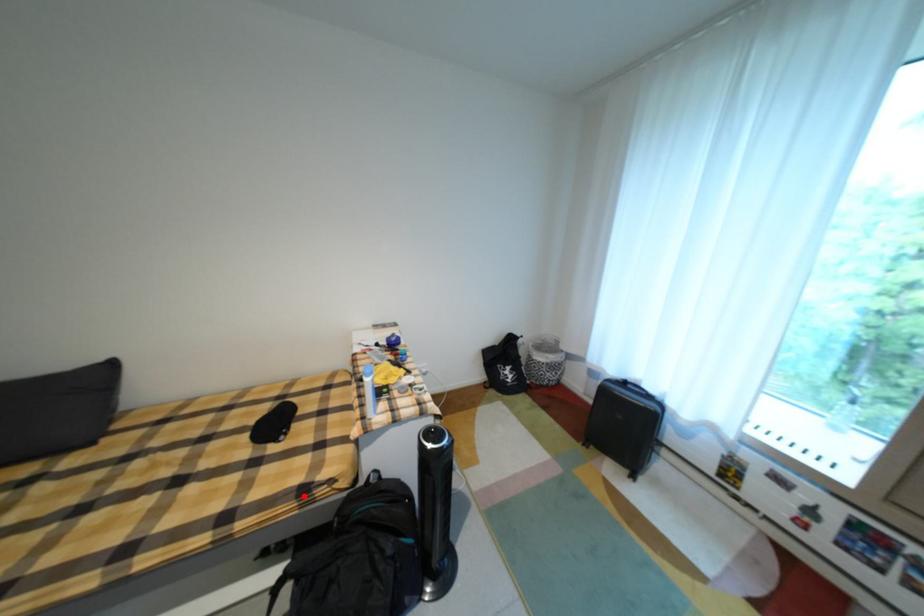
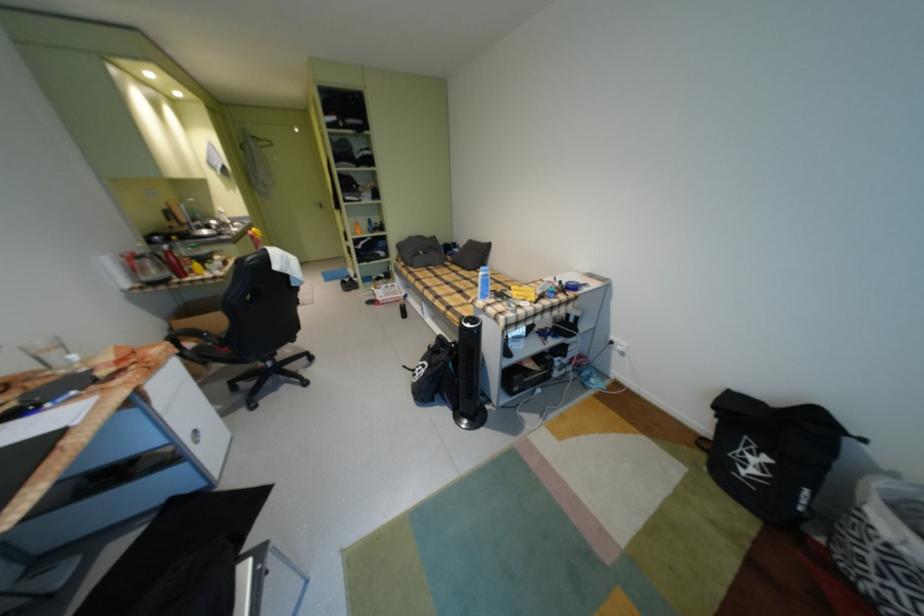
Where in the second image is the point corresponding to the highlighted location from the first image?

(470, 318)